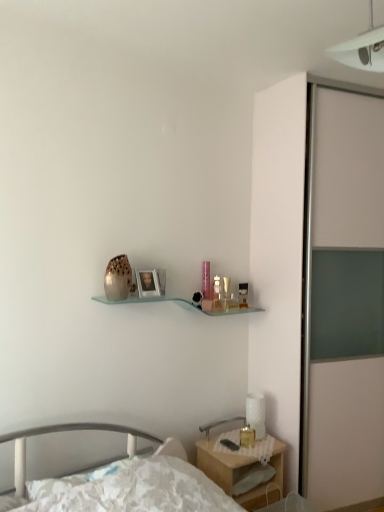
What is the approximate width of white textured table lamp at lower right?

4.88 inches.

Locate an element on the screen. white textured table lamp at lower right is located at coordinates (256, 413).

What do you see at coordinates (362, 49) in the screenshot?
I see `white plastic light fixture at upper right` at bounding box center [362, 49].

Describe the element at coordinates (218, 295) in the screenshot. Image resolution: width=384 pixels, height=512 pixels. I see `translucent glass perfume bottle at upper center, positioned as the second toiletry in back-to-front order` at that location.

What do you see at coordinates (243, 295) in the screenshot?
I see `translucent glass perfume bottle at upper center, marked as the second toiletry in a front-to-back arrangement` at bounding box center [243, 295].

Where is `brown textured vase at center`? The height and width of the screenshot is (512, 384). brown textured vase at center is located at coordinates pyautogui.click(x=118, y=278).

Find the location of a particular element. white textured table lamp at lower right is located at coordinates (256, 413).

Looking at this image, can brown textured vase at center be found inside white textured table lamp at lower right?

No, brown textured vase at center is not inside white textured table lamp at lower right.

From the image's perspective, between white textured table lamp at lower right and brown textured vase at center, which one is located above?

brown textured vase at center, from the image's perspective.

Which is nearer, (252, 426) or (113, 258)?

Positioned in front is point (113, 258).

From a real-world perspective, is white textured table lamp at lower right physically located above or below brown textured vase at center?

In terms of real-world spatial position, white textured table lamp at lower right is below brown textured vase at center.

From the image's perspective, between white matte sliding door at right and matte silver picture frame at center, who is located below?

From the image's view, white matte sliding door at right is below.

In terms of size, does white matte sliding door at right appear bigger or smaller than matte silver picture frame at center?

Clearly, white matte sliding door at right is larger in size than matte silver picture frame at center.

Is white matte sliding door at right turned away from matte silver picture frame at center?

No, matte silver picture frame at center is not at the back of white matte sliding door at right.

Is matte silver picture frame at center located within white matte sliding door at right?

Answer: No, matte silver picture frame at center is not surrounded by white matte sliding door at right.

Is white floral fabric bed at lower left wider than translucent glass candle at bedside?

Correct, the width of white floral fabric bed at lower left exceeds that of translucent glass candle at bedside.

How different are the orientations of white floral fabric bed at lower left and translucent glass candle at bedside in degrees?

22.9 degrees separate the facing orientations of white floral fabric bed at lower left and translucent glass candle at bedside.

Considering the relative sizes of white floral fabric bed at lower left and translucent glass candle at bedside in the image provided, is white floral fabric bed at lower left taller than translucent glass candle at bedside?

Correct, white floral fabric bed at lower left is much taller as translucent glass candle at bedside.

From the image's perspective, who appears lower, white floral fabric bed at lower left or translucent glass candle at bedside?

white floral fabric bed at lower left, from the image's perspective.

Is translucent glass candle at bedside surrounded by matte silver picture frame at center?

No, translucent glass candle at bedside is not inside matte silver picture frame at center.

From a real-world perspective, is matte silver picture frame at center positioned above or below translucent glass candle at bedside?

matte silver picture frame at center is above translucent glass candle at bedside.

Is white plastic light fixture at upper right positioned before wooden nightstand at lower right?

Yes, it is.

Is point (383, 53) behind point (247, 502)?

No, it is in front of (247, 502).

Does white plastic light fixture at upper right have a lesser height compared to wooden nightstand at lower right?

Yes.

Image resolution: width=384 pixels, height=512 pixels. Find the location of `light fixture above the wooden nightstand at lower right (from the image's perspective)`. light fixture above the wooden nightstand at lower right (from the image's perspective) is located at coordinates (362, 49).

Is the position of white floral fabric bed at lower left more distant than that of wooden nightstand at lower right?

No.

In the scene shown: Which of these two, white floral fabric bed at lower left or wooden nightstand at lower right, is bigger?

wooden nightstand at lower right is bigger.

Is white floral fabric bed at lower left touching wooden nightstand at lower right?

white floral fabric bed at lower left and wooden nightstand at lower right are clearly separated.

Considering the relative sizes of translucent glass perfume bottle at upper center, the first toiletry from the left, and brown textured vase at center in the image provided, is translucent glass perfume bottle at upper center, the first toiletry from the left, shorter than brown textured vase at center?

Yes, translucent glass perfume bottle at upper center, the first toiletry from the left, is shorter than brown textured vase at center.

From the picture: From a real-world perspective, is translucent glass perfume bottle at upper center, which appears as the second toiletry when viewed from the right, physically below brown textured vase at center?

Yes, from a real-world perspective, translucent glass perfume bottle at upper center, which appears as the second toiletry when viewed from the right, is under brown textured vase at center.

Are translucent glass perfume bottle at upper center, the first toiletry positioned from the front, and brown textured vase at center beside each other?

translucent glass perfume bottle at upper center, the first toiletry positioned from the front, is not next to brown textured vase at center, and they're not touching.

Between point (217, 276) and point (114, 263), which one is positioned behind?

The point (217, 276) is behind.

The width and height of the screenshot is (384, 512). I want to click on vase in front of the white textured table lamp at lower right, so click(118, 278).

Identify the location of picture frame above the white matte sliding door at right (from a real-world perspective). (148, 283).

Estimate the real-world distances between objects in this image. Which object is closer to white textured table lamp at lower right, translucent glass perfume bottle at upper center, the first toiletry from the left, or brown textured vase at center?

Based on the image, translucent glass perfume bottle at upper center, the first toiletry from the left, appears to be nearer to white textured table lamp at lower right.

Which object lies further to the anchor point translucent glass perfume bottle at upper center, the first toiletry positioned from the front, translucent glass perfume bottle at upper center, acting as the second toiletry starting from the left, or translucent glass candle at bedside?

translucent glass candle at bedside.

Based on their spatial positions, is translucent glass perfume bottle at upper center, positioned as the second toiletry in back-to-front order, or brown textured vase at center further from matte silver picture frame at center?

Among the two, translucent glass perfume bottle at upper center, positioned as the second toiletry in back-to-front order, is located further to matte silver picture frame at center.

Looking at the image, which one is located further to brown textured vase at center, wooden nightstand at lower right or white floral fabric bed at lower left?

Among the two, wooden nightstand at lower right is located further to brown textured vase at center.

Looking at the image, which one is located closer to white floral fabric bed at lower left, translucent glass perfume bottle at upper center, positioned as the second toiletry in back-to-front order, or matte silver picture frame at center?

The object closer to white floral fabric bed at lower left is matte silver picture frame at center.

Consider the image. Based on their spatial positions, is translucent glass perfume bottle at upper center, acting as the second toiletry starting from the left, or white floral fabric bed at lower left closer to translucent glass candle at bedside?

translucent glass perfume bottle at upper center, acting as the second toiletry starting from the left, is closer to translucent glass candle at bedside.

Considering their positions, is translucent glass perfume bottle at upper center, the first toiletry from the left, positioned further to white plastic light fixture at upper right than brown textured vase at center?

translucent glass perfume bottle at upper center, the first toiletry from the left, lies further to white plastic light fixture at upper right than the other object.

Considering their positions, is translucent glass perfume bottle at upper center, marked as the second toiletry in a front-to-back arrangement, positioned closer to white floral fabric bed at lower left than brown textured vase at center?

brown textured vase at center is positioned closer to the anchor white floral fabric bed at lower left.

Locate an element on the screen. picture frame between white plastic light fixture at upper right and wooden nightstand at lower right vertically is located at coordinates (148, 283).

The height and width of the screenshot is (512, 384). I want to click on table lamp between translucent glass perfume bottle at upper center, positioned as the second toiletry in back-to-front order, and translucent glass candle at bedside vertically, so click(x=256, y=413).

The width and height of the screenshot is (384, 512). What are the coordinates of `candle holder between translucent glass perfume bottle at upper center, which appears as the second toiletry when viewed from the right, and white matte sliding door at right, in the horizontal direction` in the screenshot? It's located at (247, 437).

Identify the location of toiletry positioned between white floral fabric bed at lower left and translucent glass perfume bottle at upper center, marked as the second toiletry in a front-to-back arrangement, from near to far. (218, 295).